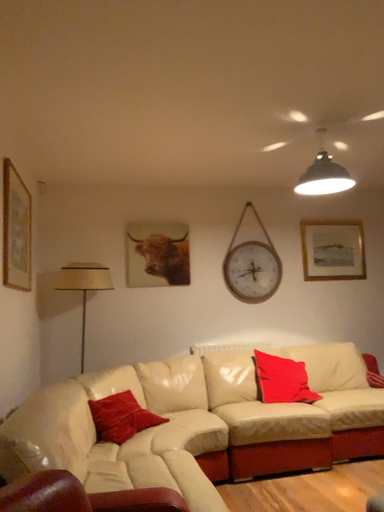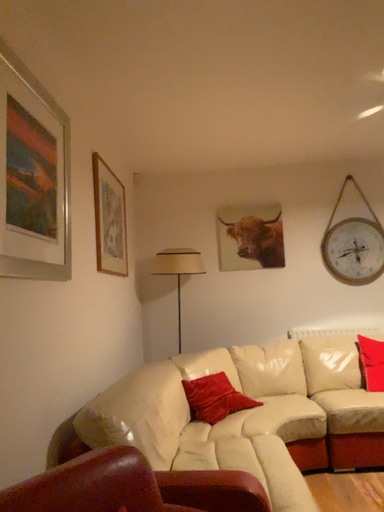
Question: How did the camera likely rotate when shooting the video?

Choices:
 (A) rotated right
 (B) rotated left

Answer: (B)